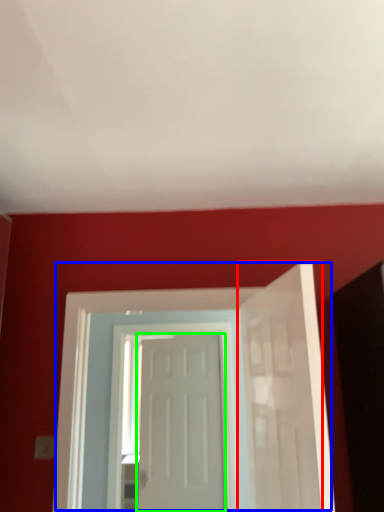
Question: Based on their relative distances, which object is nearer to door (highlighted by a red box)? Choose from door (highlighted by a blue box) and door (highlighted by a green box).

Choices:
 (A) door
 (B) door

Answer: (A)